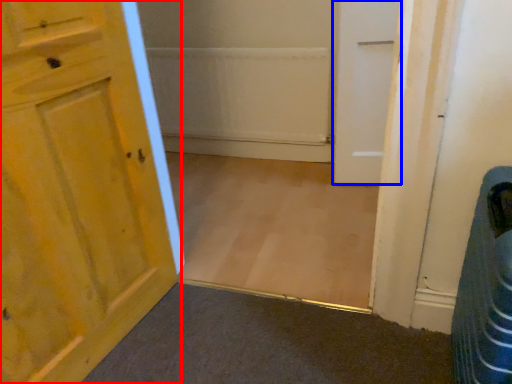
Question: Which of the following is the closest to the observer, door (highlighted by a red box) or door (highlighted by a blue box)?

Choices:
 (A) door
 (B) door

Answer: (A)